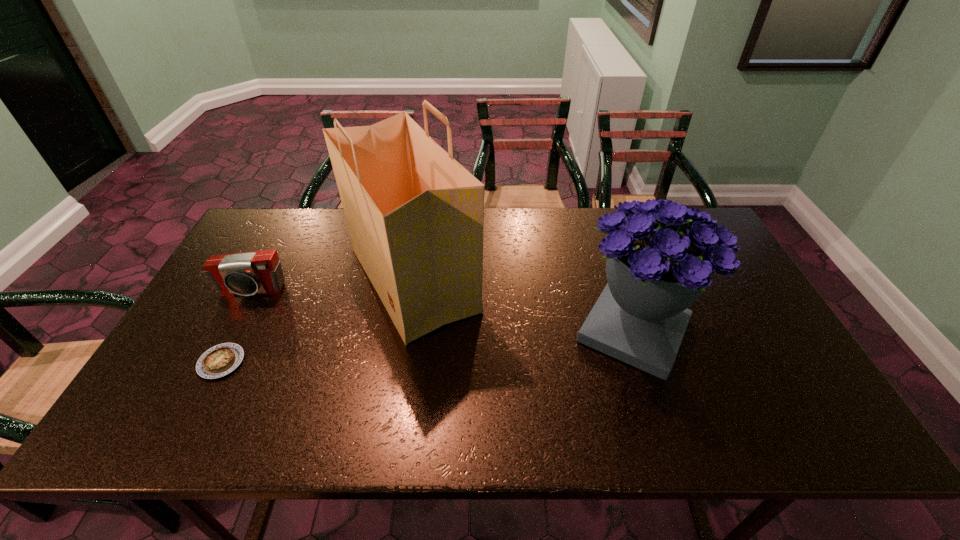
Locate an element on the screen. object that is at the far edge is located at coordinates (415, 216).

The image size is (960, 540). I want to click on camera present at the left edge, so click(256, 272).

At what (x,y) coordinates should I click in order to perform the action: click on quiche positioned at the left edge. Please return your answer as a coordinate pair (x, y). This screenshot has height=540, width=960. Looking at the image, I should click on (220, 360).

Locate an element on the screen. vacant space at the far edge is located at coordinates (323, 247).

You are a GUI agent. You are given a task and a screenshot of the screen. Output one action in this format:
    pyautogui.click(x=<x>, y=<y>)
    Task: Click on the vacant area at the near edge
    This screenshot has height=540, width=960.
    Given the screenshot: What is the action you would take?
    pyautogui.click(x=359, y=414)

This screenshot has width=960, height=540. What are the coordinates of `vacant region at the right edge of the desktop` in the screenshot? It's located at tap(712, 312).

I want to click on blank region between the shortest object and the grocery bag, so click(x=317, y=321).

At what (x,y) coordinates should I click in order to perform the action: click on free space between the second object from right to left and the quiche. Please return your answer as a coordinate pair (x, y). The image size is (960, 540). Looking at the image, I should click on (317, 321).

The width and height of the screenshot is (960, 540). I want to click on vacant space in between the third tallest object and the shortest object, so click(237, 327).

You are a GUI agent. You are given a task and a screenshot of the screen. Output one action in this format:
    pyautogui.click(x=<x>, y=<y>)
    Task: Click on the vacant point located between the camera and the grocery bag
    Image resolution: width=960 pixels, height=540 pixels.
    Given the screenshot: What is the action you would take?
    pyautogui.click(x=332, y=285)